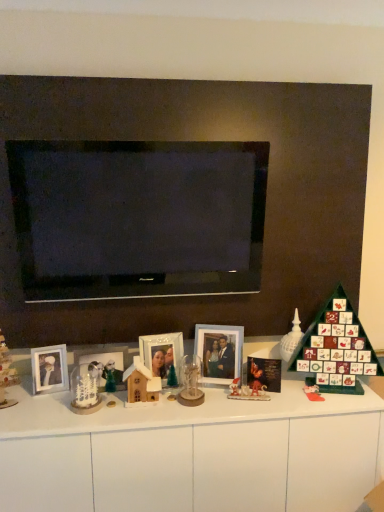
Question: From the image's perspective, is white glossy seashell at right, the 2th toy positioned from the left, below matte plastic toy at right, the first toy positioned from the right?

Choices:
 (A) no
 (B) yes

Answer: (A)

Question: Is white glossy seashell at right, the 2th toy positioned from the left, further to camera compared to matte plastic toy at right, which is the 3th toy in left-to-right order?

Choices:
 (A) yes
 (B) no

Answer: (A)

Question: Are white glossy seashell at right, which appears as the first toy when viewed from the back, and matte plastic toy at right, which is the 3th toy in left-to-right order, beside each other?

Choices:
 (A) no
 (B) yes

Answer: (A)

Question: Is white glossy seashell at right, the third toy when ordered from front to back, positioned beyond the bounds of matte plastic toy at right, which is the 3th toy in left-to-right order?

Choices:
 (A) no
 (B) yes

Answer: (B)

Question: From the image's perspective, would you say white glossy seashell at right, the 2th toy positioned from the left, is positioned over matte plastic toy at right, which is the 3th toy in left-to-right order?

Choices:
 (A) no
 (B) yes

Answer: (B)

Question: Is white glossy seashell at right, which appears as the first toy when viewed from the back, closer to the viewer compared to matte plastic toy at right, the first toy positioned from the right?

Choices:
 (A) yes
 (B) no

Answer: (B)

Question: Is white glossy seashell at right, the 2th toy positioned from the left, far from white glossy picture frame at center, the 1th picture frame positioned from the right?

Choices:
 (A) yes
 (B) no

Answer: (B)

Question: Are white glossy seashell at right, which appears as the first toy when viewed from the back, and white glossy picture frame at center, the 1th picture frame positioned from the right, making contact?

Choices:
 (A) no
 (B) yes

Answer: (A)

Question: Does white glossy seashell at right, which appears as the first toy when viewed from the back, have a larger size compared to white glossy picture frame at center, the 1th picture frame positioned from the right?

Choices:
 (A) no
 (B) yes

Answer: (A)

Question: Does white glossy seashell at right, the third toy when ordered from front to back, come behind white glossy picture frame at center, the 1th picture frame positioned from the right?

Choices:
 (A) yes
 (B) no

Answer: (A)

Question: Is white glossy seashell at right, the 2th toy positioned from the left, positioned before white glossy picture frame at center, the third picture frame viewed from the left?

Choices:
 (A) yes
 (B) no

Answer: (B)

Question: Is white glossy seashell at right, the third toy when ordered from front to back, completely or partially outside of white glossy picture frame at center, the third picture frame viewed from the left?

Choices:
 (A) yes
 (B) no

Answer: (A)

Question: Does wooden house at center, the third toy viewed from the right, have a lesser height compared to white glossy dresser at center?

Choices:
 (A) yes
 (B) no

Answer: (A)